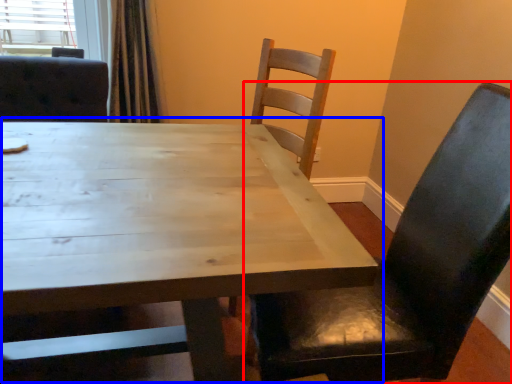
Question: Which object appears farthest to the camera in this image, chair (highlighted by a red box) or table (highlighted by a blue box)?

Choices:
 (A) chair
 (B) table

Answer: (A)